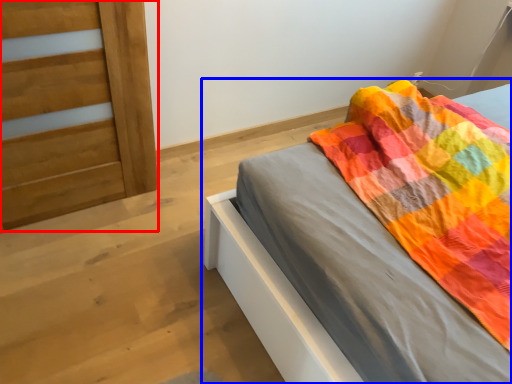
Question: Which of the following is the farthest to the observer, door (highlighted by a red box) or bed (highlighted by a blue box)?

Choices:
 (A) door
 (B) bed

Answer: (A)